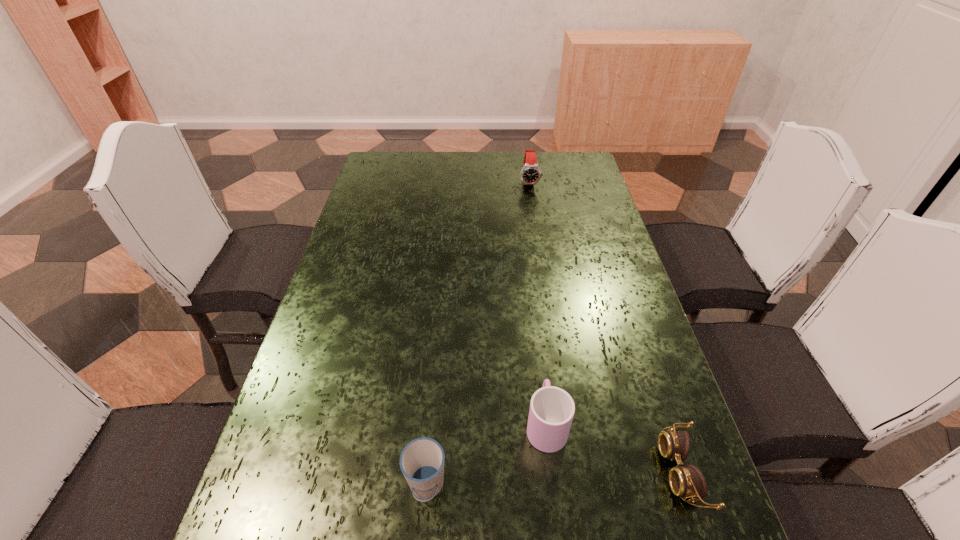
At what (x,y) coordinates should I click in order to perform the action: click on free spot between the goggles and the left cup. Please return your answer as a coordinate pair (x, y). Looking at the image, I should click on (554, 478).

Image resolution: width=960 pixels, height=540 pixels. What are the coordinates of `vacant area that lies between the leftmost object and the rightmost object` in the screenshot? It's located at (554, 478).

This screenshot has height=540, width=960. What are the coordinates of `vacant space that is in between the farthest object and the right cup` in the screenshot? It's located at (538, 303).

Identify the location of free area in between the farther cup and the left cup. The image size is (960, 540). (486, 456).

You are a GUI agent. You are given a task and a screenshot of the screen. Output one action in this format:
    pyautogui.click(x=<x>, y=<y>)
    Task: Click on the free area in between the left cup and the farthest object
    
    Given the screenshot: What is the action you would take?
    pyautogui.click(x=478, y=335)

The width and height of the screenshot is (960, 540). What are the coordinates of `vacant space in between the rightmost object and the nearer cup` in the screenshot? It's located at (554, 478).

You are a GUI agent. You are given a task and a screenshot of the screen. Output one action in this format:
    pyautogui.click(x=<x>, y=<y>)
    Task: Click on the free space that is in between the left cup and the goggles
    The height and width of the screenshot is (540, 960).
    Given the screenshot: What is the action you would take?
    pyautogui.click(x=554, y=478)

Find the location of a particular element. vacant space that's between the right cup and the farthest object is located at coordinates (538, 303).

Identify the location of free space between the farthest object and the rightmost object. This screenshot has width=960, height=540. (606, 326).

Where is `object that stands as the third closest to the shortest object`? The image size is (960, 540). object that stands as the third closest to the shortest object is located at coordinates (530, 174).